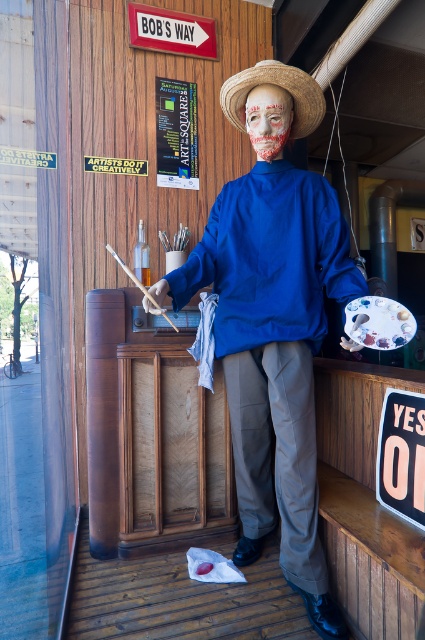
Is strawhat at center positioned at the back of blood-stained fabric mask at center?

No, it is in front of blood-stained fabric mask at center.

Can you confirm if strawhat at center is positioned to the left of blood-stained fabric mask at center?

No, strawhat at center is not to the left of blood-stained fabric mask at center.

Find the location of a particular element. The width and height of the screenshot is (425, 640). strawhat at center is located at coordinates (280, 86).

Measure the distance between point (227, 115) and camera.

A distance of 5.97 feet exists between point (227, 115) and camera.

Is matte blue shirt at center smaller than blood-stained fabric mask at center?

No, matte blue shirt at center is not smaller than blood-stained fabric mask at center.

Between point (299, 234) and point (255, 141), which one is positioned behind?

The point (255, 141) is more distant.

Find the location of a particular element. Image resolution: width=425 pixels, height=640 pixels. matte blue shirt at center is located at coordinates (274, 353).

Which is more to the left, matte blue shirt at center or strawhat at center?

Positioned to the left is matte blue shirt at center.

Between point (300, 532) and point (305, 112), which one is positioned behind?

The point (305, 112) is behind.

The width and height of the screenshot is (425, 640). I want to click on matte blue shirt at center, so click(x=274, y=353).